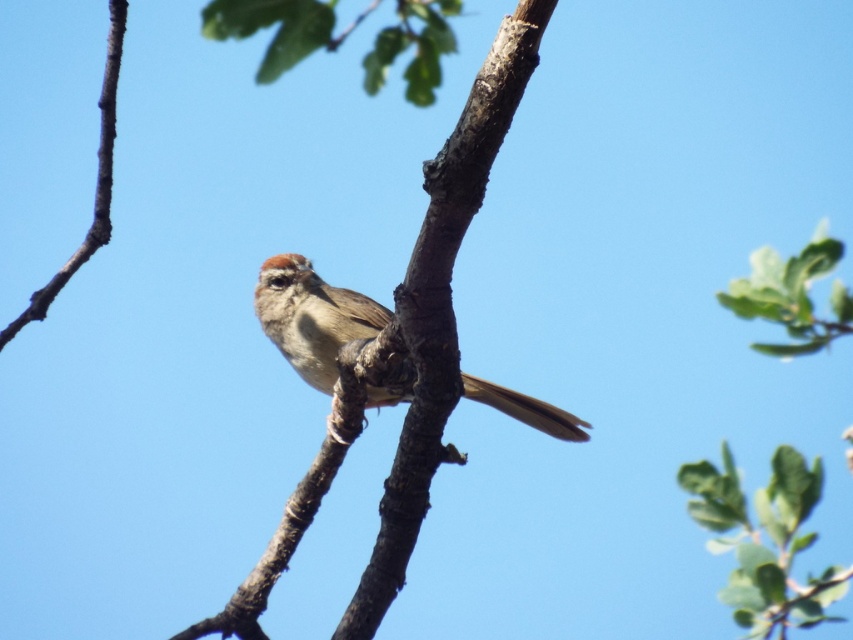
You are a birdwatcher observing the scene. You notice the green leafy branch at upper right and the brown speckled sparrow at center. Which object is closer to you?

The green leafy branch at upper right is closer to you because it is in front of the brown speckled sparrow at center.

You are standing in front of the tree and looking at the two points marked on the image. Which point, point (421,419) or point (802,285), is closer to you?

Point (421,419) is closer to you because it is in front of point (802,285).